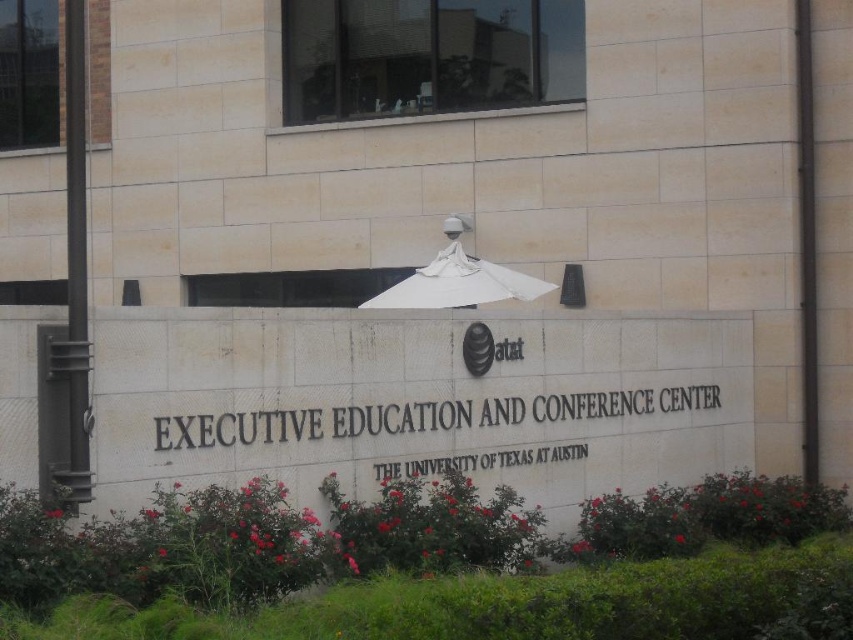
Who is more forward, (273, 435) or (442, 268)?

Point (273, 435) is more forward.

Who is lower down, white stone sign at center or white matte umbrella at center?

white stone sign at center

Is point (184, 449) positioned before point (483, 296)?

Yes.

Locate an element on the screen. white stone sign at center is located at coordinates (421, 417).